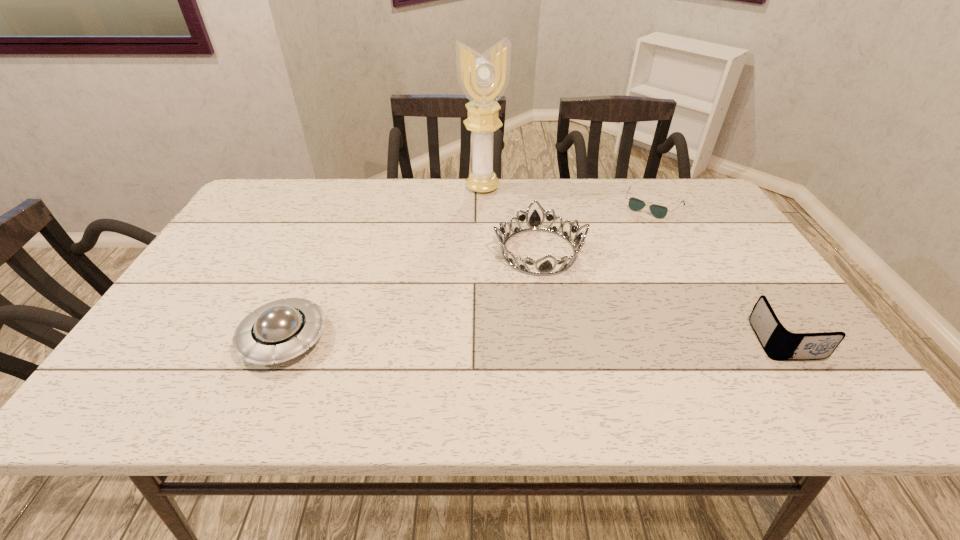
I want to click on saucer, so click(x=281, y=330).

What are the coordinates of `wallet` in the screenshot? It's located at (779, 344).

Where is `the third nearest object`? The height and width of the screenshot is (540, 960). the third nearest object is located at coordinates (545, 268).

The height and width of the screenshot is (540, 960). Find the location of `the tallest object`. the tallest object is located at coordinates (483, 78).

You are a GUI agent. You are given a task and a screenshot of the screen. Output one action in this format:
    pyautogui.click(x=<x>, y=<y>)
    Task: Click on the sunglasses
    This screenshot has width=960, height=540.
    Given the screenshot: What is the action you would take?
    pyautogui.click(x=658, y=211)

The height and width of the screenshot is (540, 960). I want to click on free space located 0.090m on the back of the saucer, so click(x=308, y=282).

Where is `vacant position located 0.190m on the front-facing side of the tiara`? The width and height of the screenshot is (960, 540). vacant position located 0.190m on the front-facing side of the tiara is located at coordinates (560, 342).

This screenshot has width=960, height=540. I want to click on vacant space located on the front-facing side of the tiara, so click(x=558, y=335).

Where is `free location located on the front-facing side of the tiara`? This screenshot has width=960, height=540. free location located on the front-facing side of the tiara is located at coordinates (554, 318).

The image size is (960, 540). In order to click on free space located on the front-facing side of the tallest object in this screenshot , I will do `click(507, 237)`.